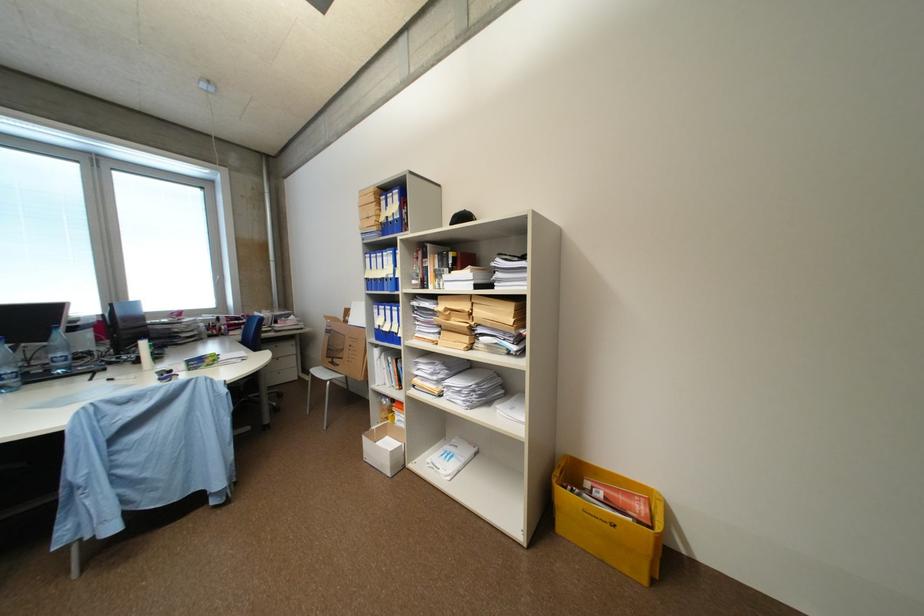
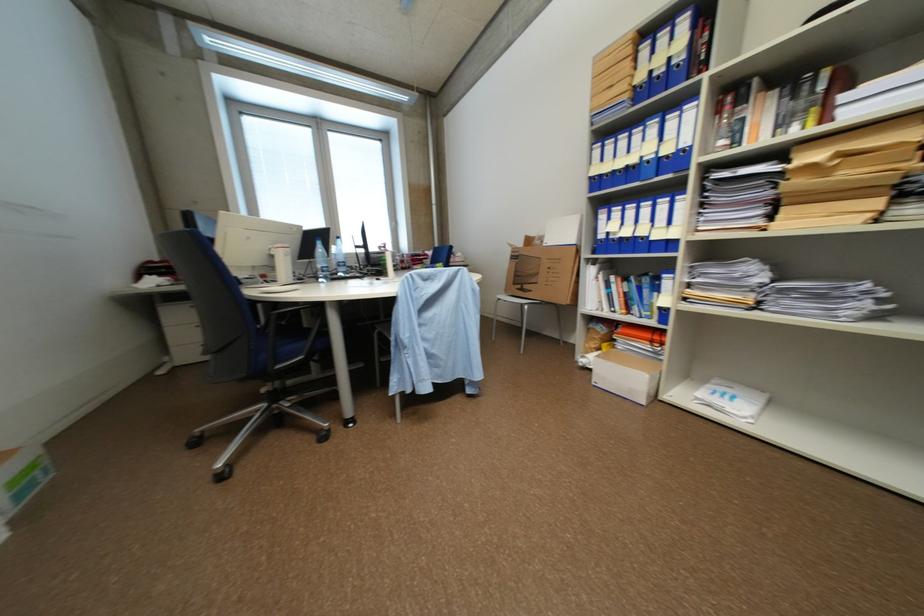
Question: In a continuous first-person perspective shot, in which direction is the camera moving?

Choices:
 (A) Left
 (B) Right
 (C) Forward
 (D) Backward

Answer: (A)